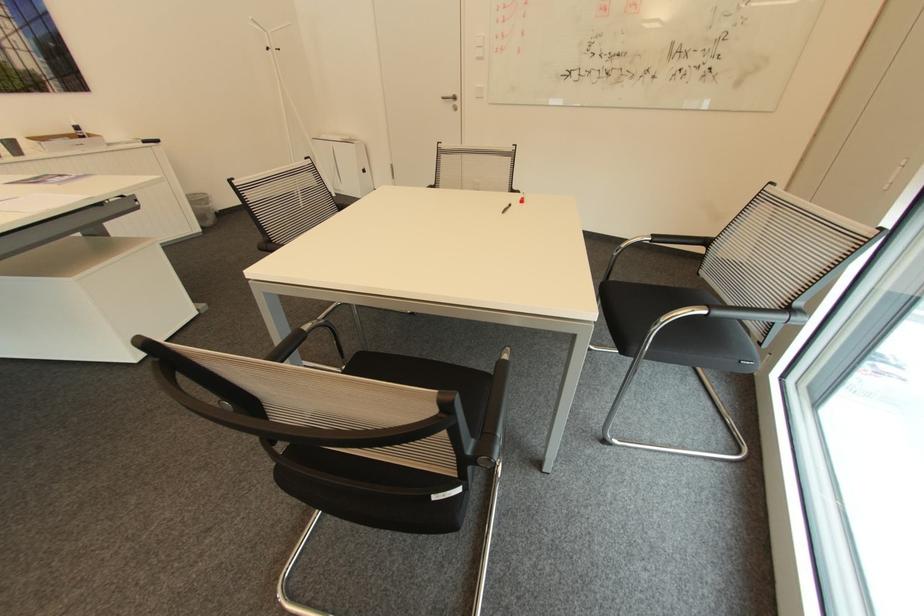
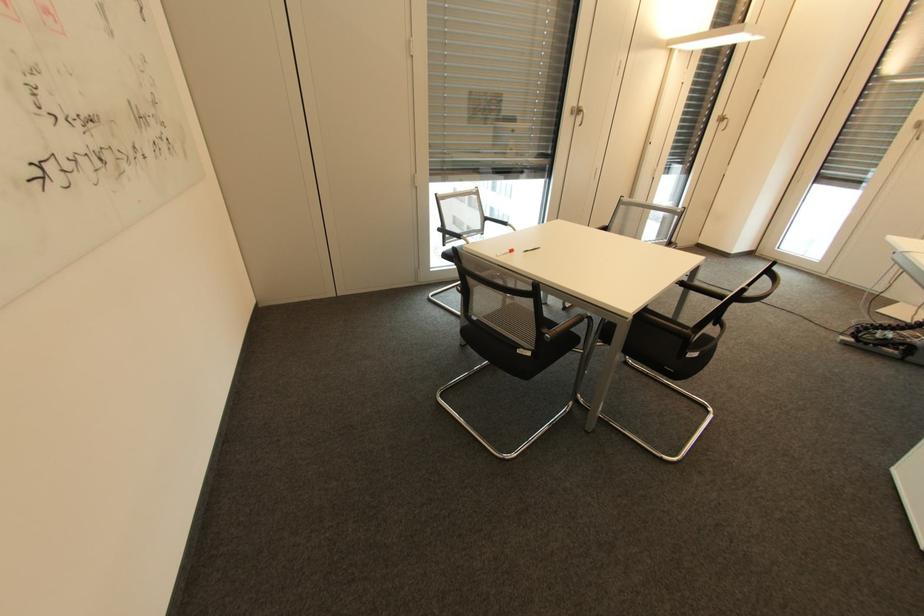
The point at (710, 241) is marked in the first image. Where is the corresponding point in the second image?

(448, 229)